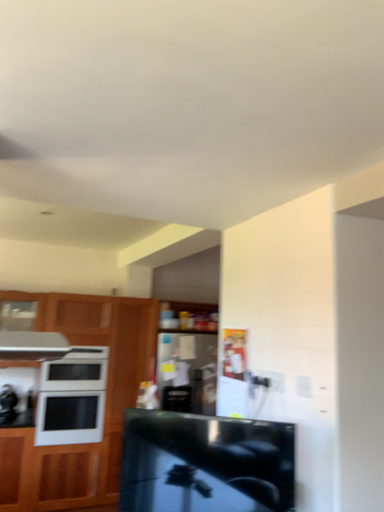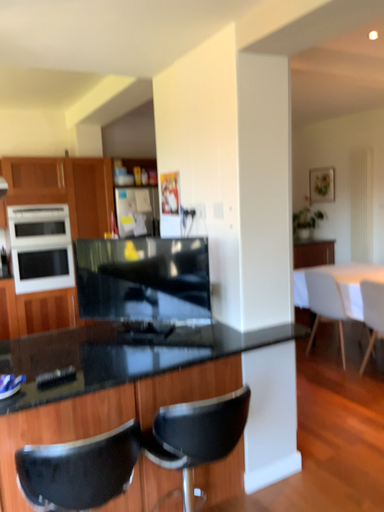
Question: Which way did the camera rotate in the video?

Choices:
 (A) rotated upward
 (B) rotated downward

Answer: (B)